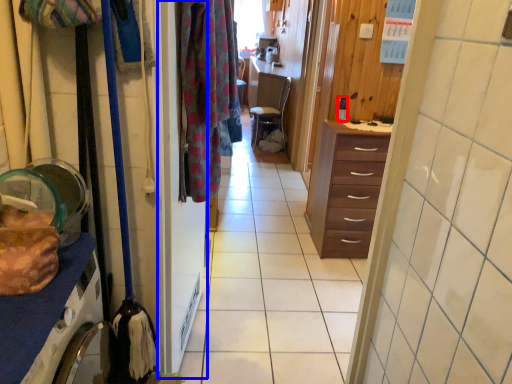
Question: Which object is closer to the camera taking this photo, coffee cup (highlighted by a red box) or screen door (highlighted by a blue box)?

Choices:
 (A) coffee cup
 (B) screen door

Answer: (B)